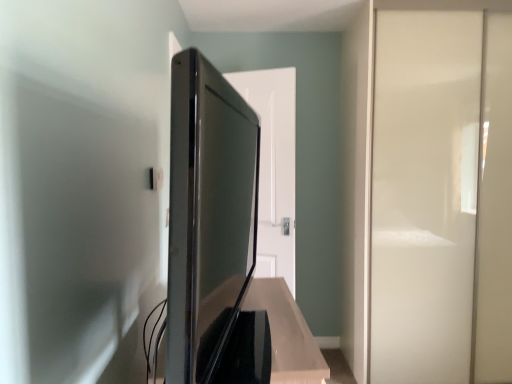
Question: Is satin black tv at center not near white glossy screen door at right?

Choices:
 (A) yes
 (B) no

Answer: (A)

Question: Is satin black tv at center oriented towards white glossy screen door at right?

Choices:
 (A) no
 (B) yes

Answer: (A)

Question: Considering the relative positions of satin black tv at center and white glossy screen door at right in the image provided, is satin black tv at center to the left of white glossy screen door at right from the viewer's perspective?

Choices:
 (A) yes
 (B) no

Answer: (A)

Question: From the image's perspective, does satin black tv at center appear lower than white glossy screen door at right?

Choices:
 (A) no
 (B) yes

Answer: (B)

Question: Does satin black tv at center have a greater height compared to white glossy screen door at right?

Choices:
 (A) yes
 (B) no

Answer: (B)

Question: Is satin black tv at center shorter than white glossy screen door at right?

Choices:
 (A) yes
 (B) no

Answer: (A)

Question: From the image's perspective, is white glossy screen door at right beneath white glossy door at center?

Choices:
 (A) no
 (B) yes

Answer: (A)

Question: Is white glossy screen door at right at the right side of white glossy door at center?

Choices:
 (A) yes
 (B) no

Answer: (A)

Question: Is white glossy door at center at the back of white glossy screen door at right?

Choices:
 (A) yes
 (B) no

Answer: (B)

Question: From the image's perspective, is white glossy screen door at right on white glossy door at center?

Choices:
 (A) no
 (B) yes

Answer: (B)

Question: Considering the relative positions of white glossy screen door at right and white glossy door at center in the image provided, is white glossy screen door at right to the left of white glossy door at center from the viewer's perspective?

Choices:
 (A) yes
 (B) no

Answer: (B)

Question: Is white glossy screen door at right bigger than white glossy door at center?

Choices:
 (A) yes
 (B) no

Answer: (A)

Question: Does satin black tv at center have a greater height compared to white glossy door at center?

Choices:
 (A) no
 (B) yes

Answer: (A)